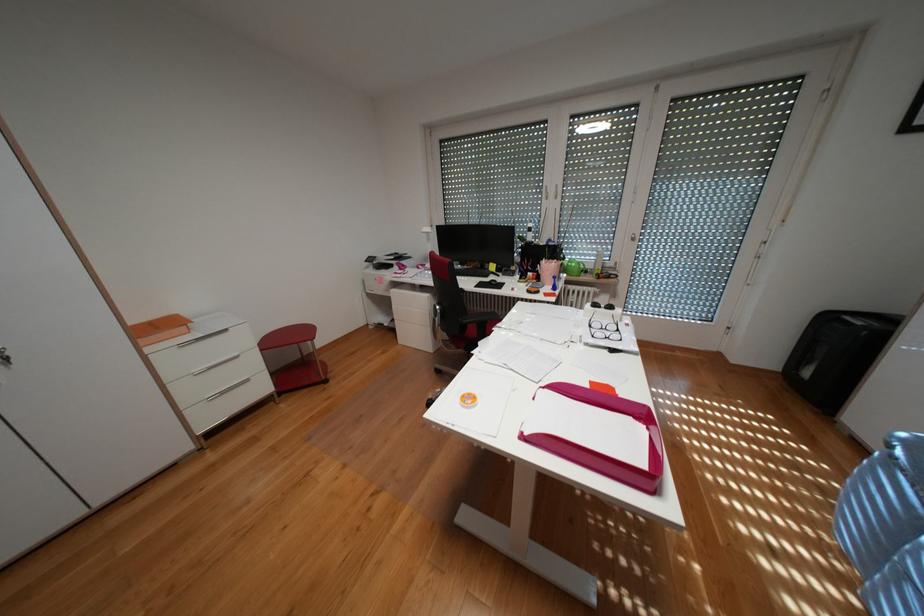
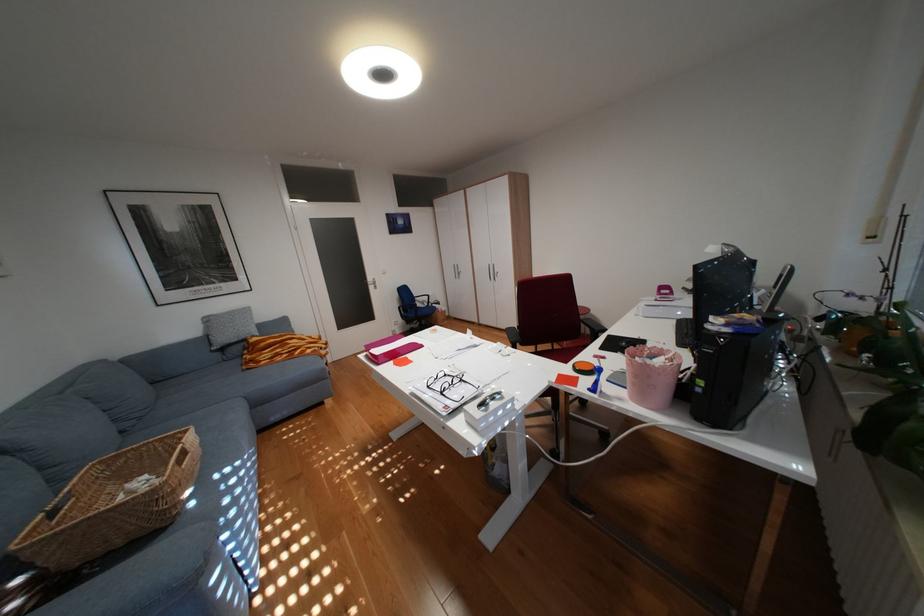
Find the pixel in the second image that matches point (629, 330) in the first image.

(454, 392)